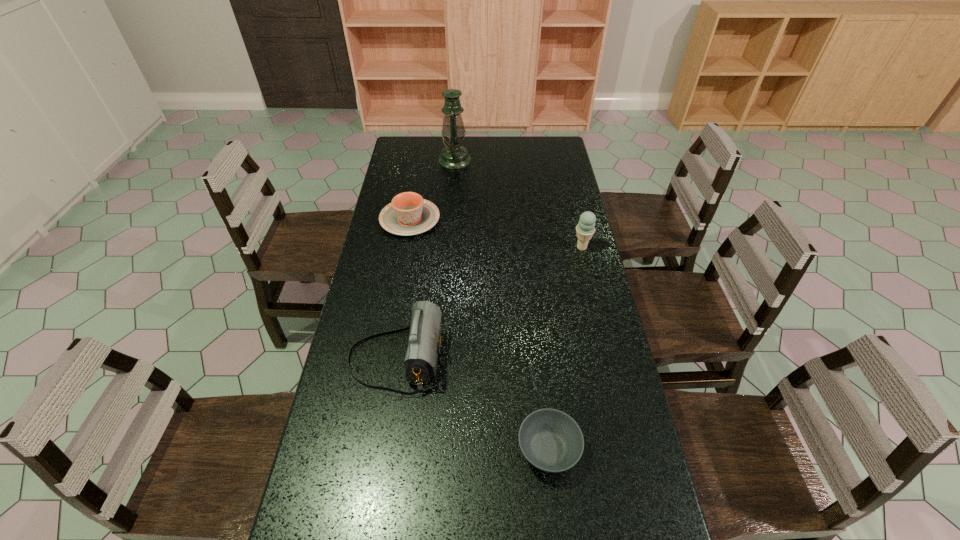
The image size is (960, 540). What are the coordinates of `oil lamp` in the screenshot? It's located at (454, 156).

You are a GUI agent. You are given a task and a screenshot of the screen. Output one action in this format:
    pyautogui.click(x=<x>, y=<y>)
    Task: Click on the farthest object
    Image resolution: width=960 pixels, height=540 pixels.
    Given the screenshot: What is the action you would take?
    pyautogui.click(x=454, y=156)

Identify the location of shoulder bag. The width and height of the screenshot is (960, 540). (424, 342).

Identify the location of ice cream. This screenshot has height=540, width=960. (585, 229).

Image resolution: width=960 pixels, height=540 pixels. I want to click on the third farthest object, so click(x=585, y=229).

I want to click on the second farthest object, so click(x=408, y=214).

Locate an element on the screen. This screenshot has width=960, height=540. the second shortest object is located at coordinates (408, 214).

What are the coordinates of `the shortest object` in the screenshot? It's located at (550, 440).

Find the location of `soup bowl`. soup bowl is located at coordinates (550, 440).

Identify the location of vacant region located on the front of the tallest object. (453, 180).